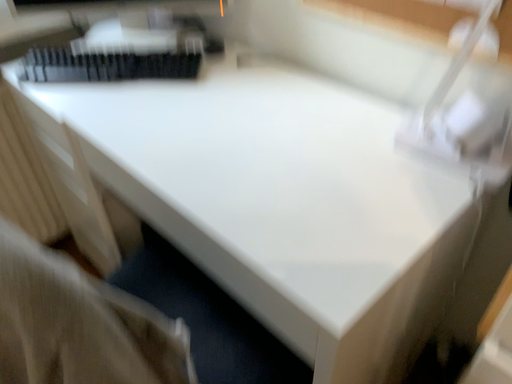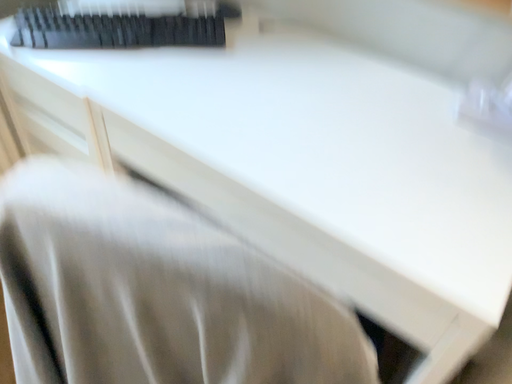
Question: Which way did the camera rotate in the video?

Choices:
 (A) rotated right
 (B) rotated left

Answer: (A)